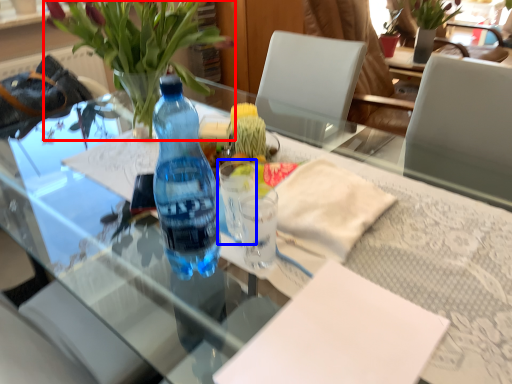
Question: Which object appears farthest to the camera in this image, houseplant (highlighted by a red box) or coffee cup (highlighted by a blue box)?

Choices:
 (A) houseplant
 (B) coffee cup

Answer: (B)